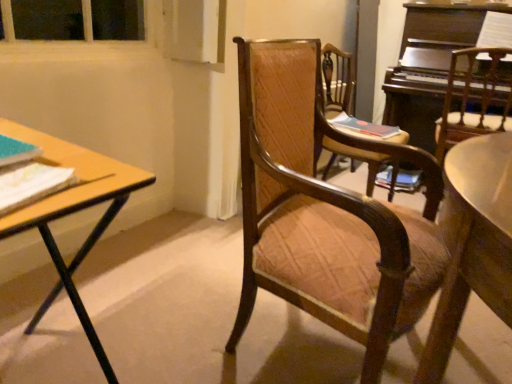
The height and width of the screenshot is (384, 512). I want to click on vacant area that lies to the right of matte blue book at left, positioned as the 1th book in left-to-right order, so click(x=55, y=174).